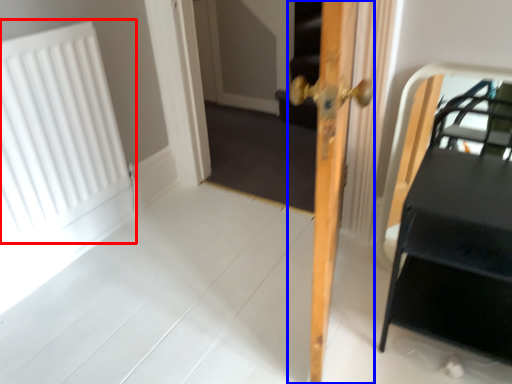
Question: Among these objects, which one is farthest to the camera, radiator (highlighted by a red box) or door (highlighted by a blue box)?

Choices:
 (A) radiator
 (B) door

Answer: (A)